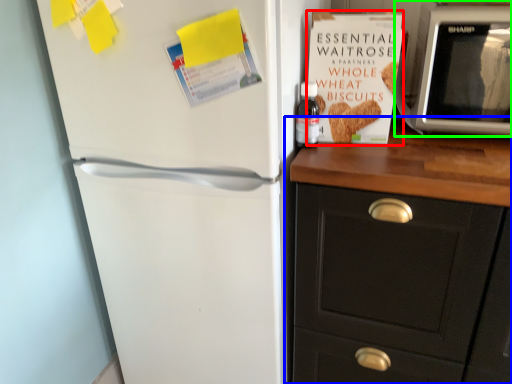
Question: Considering the real-world distances, which object is farthest from paperback book (highlighted by a red box)? cabinetry (highlighted by a blue box) or microwave oven (highlighted by a green box)?

Choices:
 (A) cabinetry
 (B) microwave oven

Answer: (A)